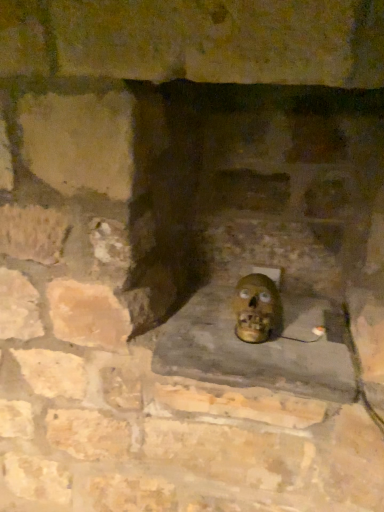
At what (x,y) coordinates should I click in order to perform the action: click on free space behind gold metallic skull at center. Please return your answer as a coordinate pair (x, y). This screenshot has height=512, width=384. Looking at the image, I should click on pos(277,310).